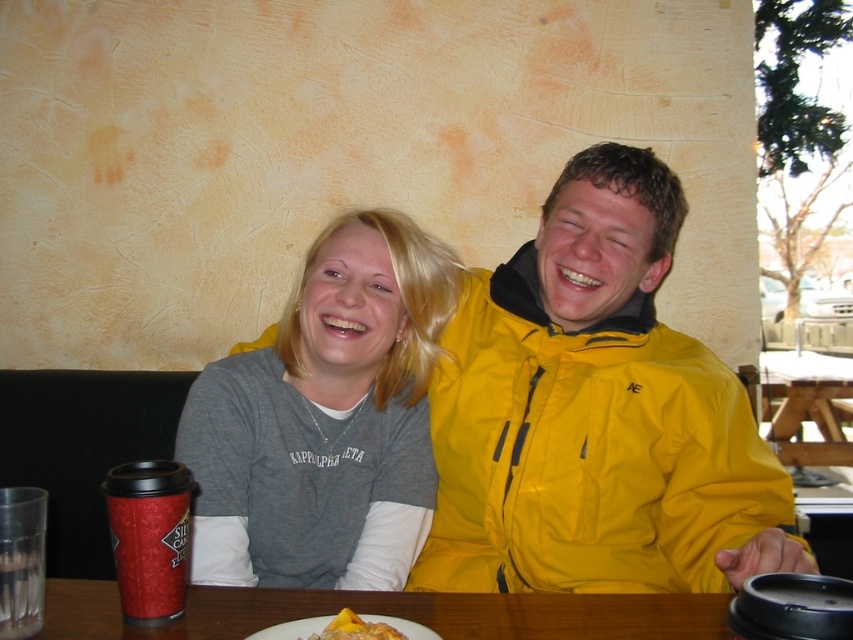
You are a photographer taking a picture of the brown wooden table at center and the yellow matte cake at lower center. Which object should you focus on first if you want to capture both in sharp focus?

The brown wooden table at center is positioned under the yellow matte cake at lower center, so focusing on the brown wooden table at center first would ensure both are in sharp focus since it is closer to the camera.

You are standing 1.5 meters away from the table where the two people are sitting. There is a specific point marked at coordinates point (671, 525) on the table. Can you reach that point without moving closer than 1.5 meters to the table?

The distance of point (671, 525) from viewer is 1.31 meters, which is closer than your current position of 1.5 meters. Therefore, you cannot reach the point without moving closer than 1.5 meters to the table.